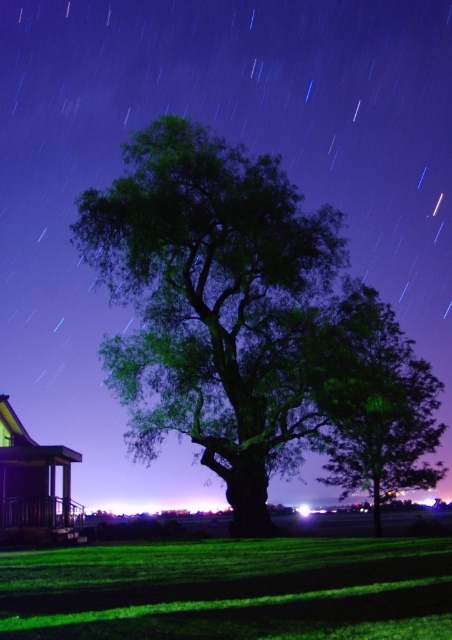
What do you see at coordinates (221, 307) in the screenshot? This screenshot has width=452, height=640. I see `green leafy oak tree at center` at bounding box center [221, 307].

Who is positioned more to the right, green leafy oak tree at center or green leafy tree at center?

Positioned to the right is green leafy tree at center.

Who is more distant from viewer, (239,492) or (433,380)?

The point (433,380) is more distant.

I want to click on green leafy oak tree at center, so click(x=221, y=307).